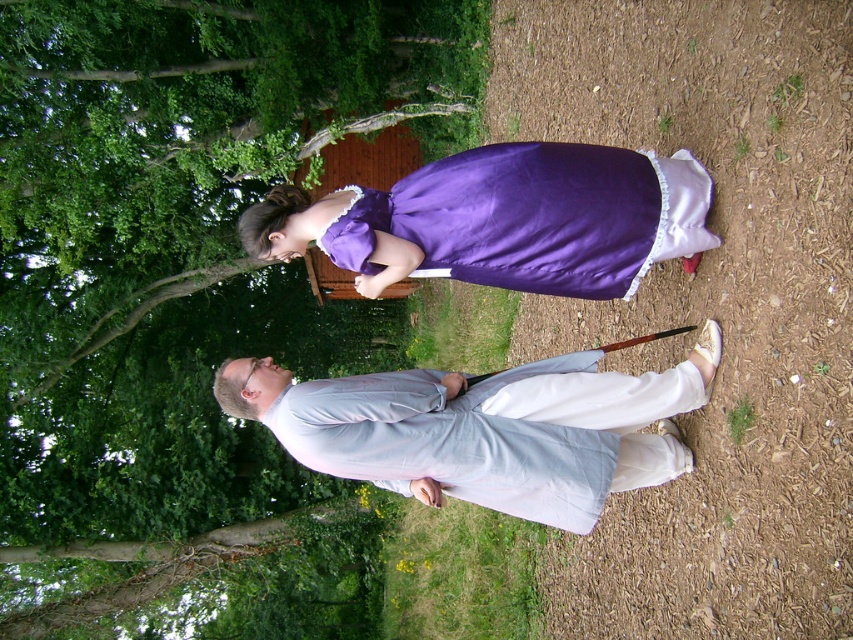
Question: Which object is closer to the camera taking this photo?

Choices:
 (A) light gray fabric robe at center
 (B) green leafy tree at upper center
 (C) purple satin dress at center

Answer: (A)

Question: Observing the image, what is the correct spatial positioning of green leafy tree at upper center in reference to light gray fabric robe at center?

Choices:
 (A) left
 (B) right

Answer: (A)

Question: Which is farther from the light gray fabric robe at center?

Choices:
 (A) green leafy tree at upper center
 (B) purple satin dress at center

Answer: (A)

Question: Which of the following is the closest to the observer?

Choices:
 (A) green leafy tree at upper center
 (B) light gray fabric robe at center

Answer: (B)

Question: Does green leafy tree at upper center appear on the right side of purple satin dress at center?

Choices:
 (A) no
 (B) yes

Answer: (A)

Question: Can you confirm if green leafy tree at upper center is positioned to the right of purple satin dress at center?

Choices:
 (A) no
 (B) yes

Answer: (A)